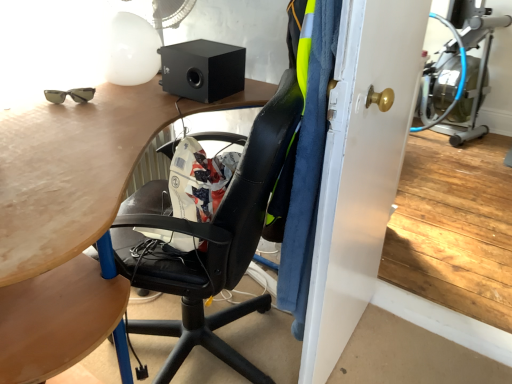
At what (x,y) coordinates should I click in order to perform the action: click on blank area beneath matte gold door handle at center (from a real-world perspective). Please return your answer as a coordinate pair (x, y). This screenshot has width=512, height=384. Looking at the image, I should click on (353, 341).